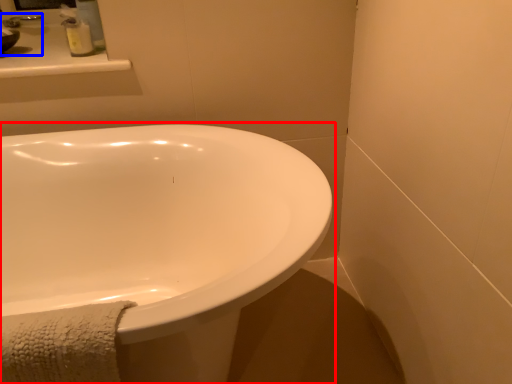
Question: Which of the following is the farthest to the observer, bathtub (highlighted by a red box) or sink (highlighted by a blue box)?

Choices:
 (A) bathtub
 (B) sink

Answer: (B)